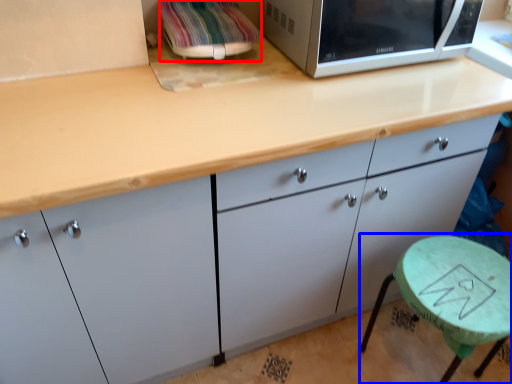
Question: Among these objects, which one is nearest to the camera, appliance (highlighted by a red box) or round table (highlighted by a blue box)?

Choices:
 (A) appliance
 (B) round table

Answer: (B)